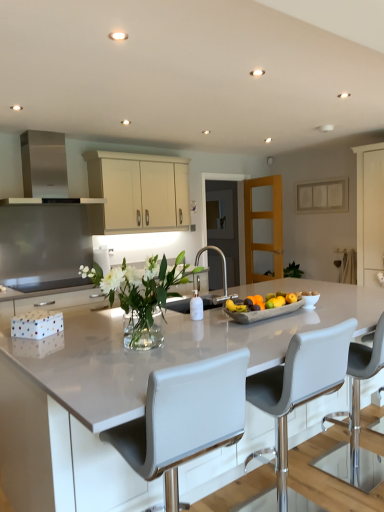
This screenshot has height=512, width=384. What are the coordinates of `blank space to the left of clear glass vase at center` in the screenshot? It's located at (53, 351).